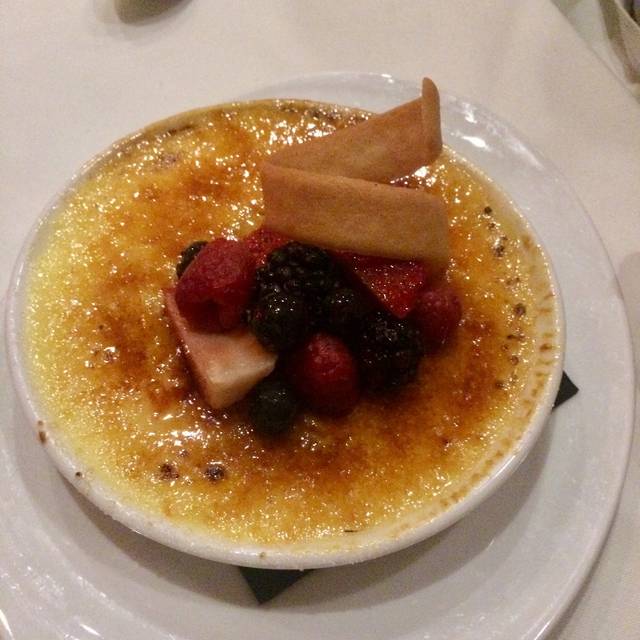
Where is `white bowl`? white bowl is located at coordinates pos(458,506).